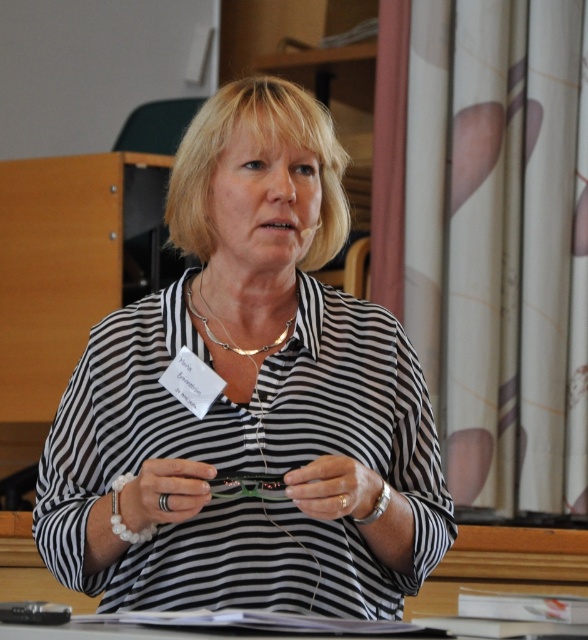
You are organizing a clothing inventory and need to determine which item takes up more space horizontally. Based on the scene, which object is wider between the black striped shirt at center and the silver metallic necklace at center?

The black striped shirt at center is wider than the silver metallic necklace at center, so the black striped shirt at center takes up more horizontal space.

You are attending a virtual meeting and need to determine which object is shorter between the black matte ring at center and the silver metallic necklace at center. Based on the scene description, which one is shorter?

The black matte ring at center has a lesser height compared to the silver metallic necklace at center, so the black matte ring at center is shorter.